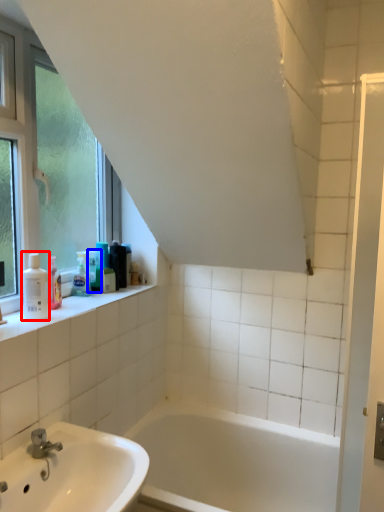
Question: Which object appears farthest to the camera in this image, toiletry (highlighted by a red box) or toiletry (highlighted by a blue box)?

Choices:
 (A) toiletry
 (B) toiletry

Answer: (B)